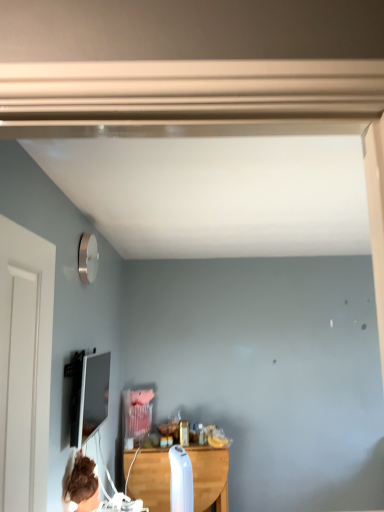
Find the location of `wooden table at lower center`. wooden table at lower center is located at coordinates (209, 477).

Measure the distance between wooden table at lower center and camera.

wooden table at lower center and camera are 3.37 meters apart.

What do you see at coordinates (209, 477) in the screenshot?
I see `wooden table at lower center` at bounding box center [209, 477].

Where is `wooden table at lower center`? Image resolution: width=384 pixels, height=512 pixels. wooden table at lower center is located at coordinates (209, 477).